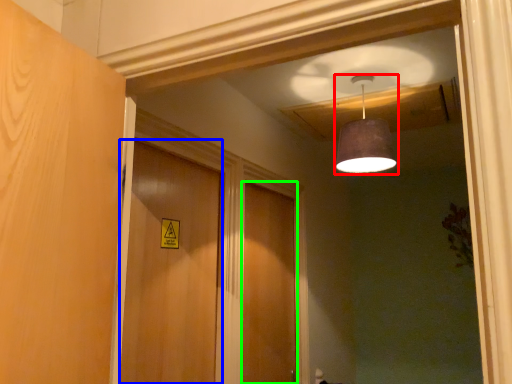
Question: Based on their relative distances, which object is nearer to lamp (highlighted by a red box)? Choose from door (highlighted by a blue box) and door (highlighted by a green box).

Choices:
 (A) door
 (B) door

Answer: (A)